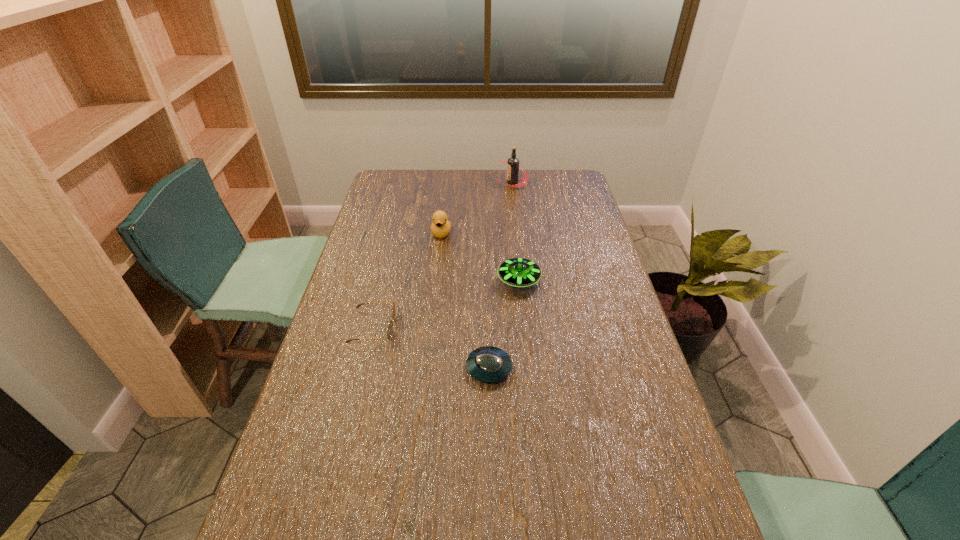
Locate an element on the screen. free space that satisfies the following two spatial constraints: 1. on the back side of the shorter saucer; 2. on the right side of the taller saucer is located at coordinates (488, 280).

Locate an element on the screen. Image resolution: width=960 pixels, height=540 pixels. vacant area in the image that satisfies the following two spatial constraints: 1. on the face of the duckling; 2. on the right side of the third nearest object is located at coordinates (436, 280).

At what (x,y) coordinates should I click in order to perform the action: click on free space that satisfies the following two spatial constraints: 1. on the label of the tallest object; 2. on the face of the duckling. Please return your answer as a coordinate pair (x, y). The width and height of the screenshot is (960, 540). Looking at the image, I should click on (517, 233).